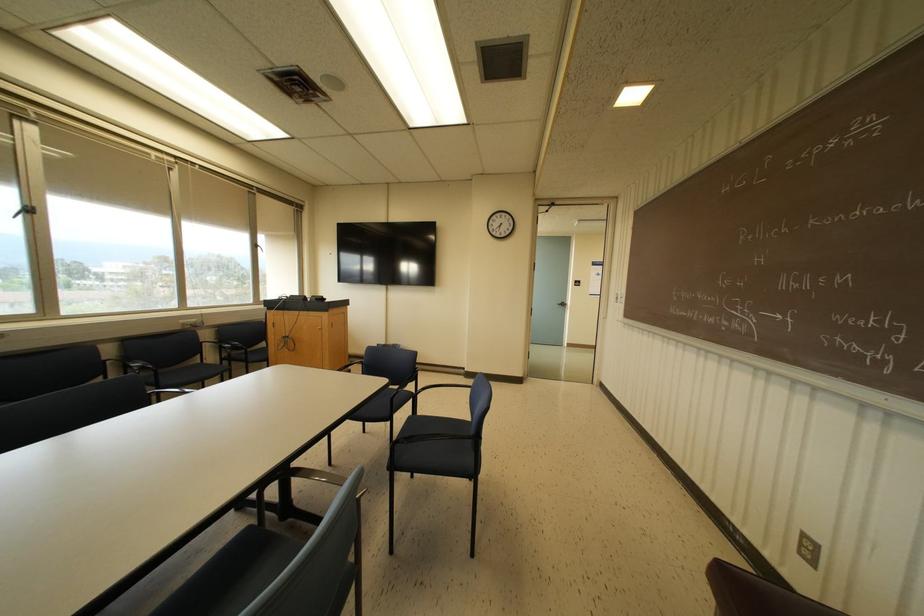
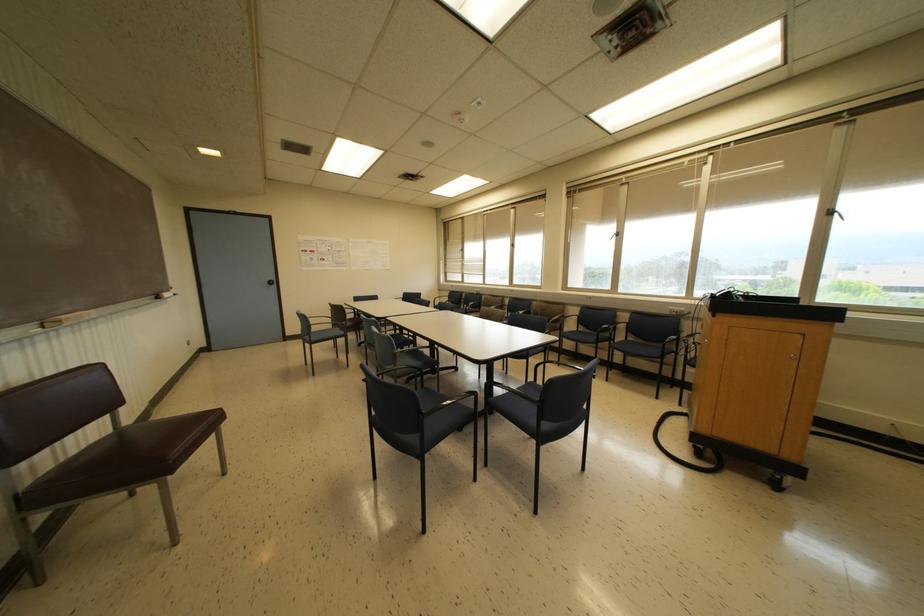
The point at (254, 245) is marked in the first image. Where is the corresponding point in the second image?

(827, 213)